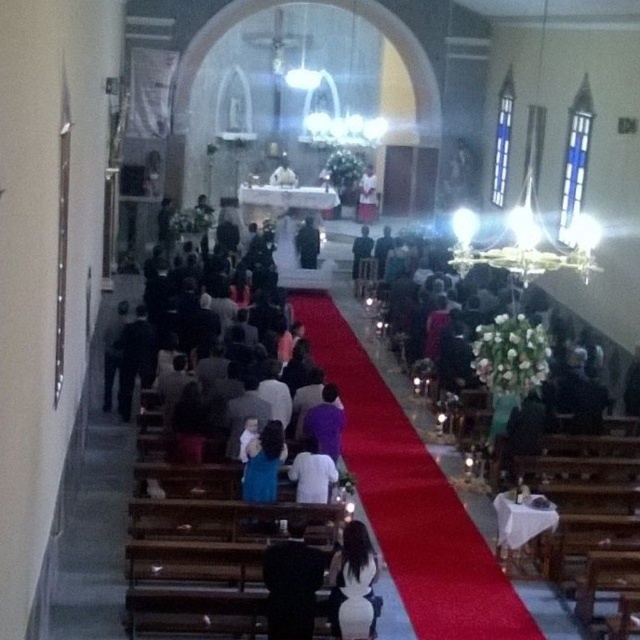
You are standing at the back of the church and see the black fabric at lower center and the white cloth at center. Which item is closer to the altar?

The white cloth at center is closer to the altar because the black fabric at lower center is positioned under it, meaning the white cloth is in front and nearer to the altar.

Based on the photo, you are standing at the back of the church and see the white matte shirt at center and the black velvet suit at center. Which one is closer to the altar?

The white matte shirt at center is below the black velvet suit at center, meaning it is closer to the altar since it is positioned lower in the image from your perspective.

You are standing at the back of the church and want to walk towards the altar. There are two points marked on the floor in front of you. One is at point (312, 477) and the other is at point (310, 257). Which point should you step on first if you want to reach the altar as quickly as possible?

You should step on point (312, 477) first because it is closer to the viewer than point (310, 257), so it is on the path towards the altar.